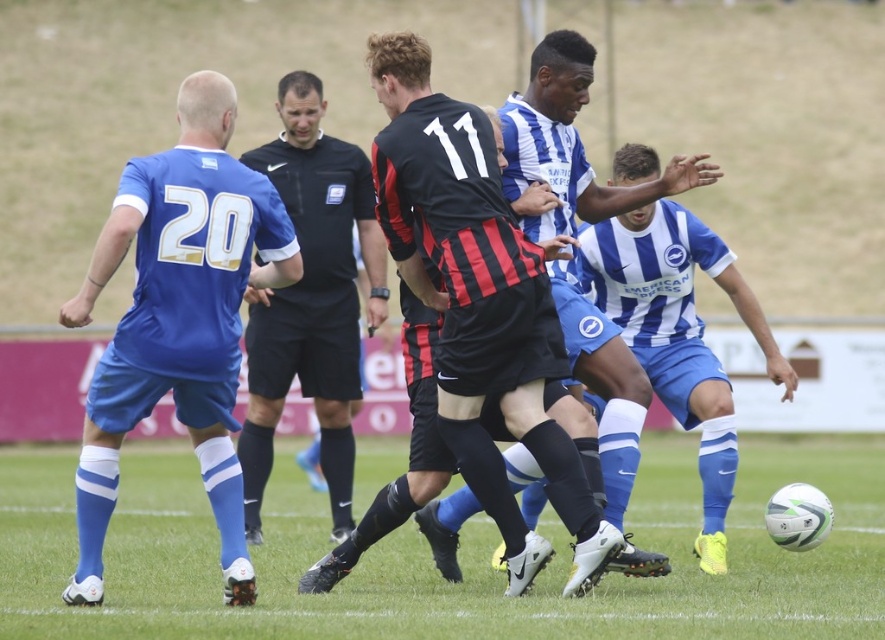
You are a soccer coach analyzing the game footage. You notice the white textured football at center and the blue striped jersey at center. Which object appears larger in the image?

The white textured football at center appears larger than the blue striped jersey at center in the image.

You are a soccer player positioned at the edge of the field. You need to pass the ball to your teammate wearing the matte blue jersey at left. The ball is currently with the player in the center holding the white textured football at center. Can you directly pass the ball to your teammate without the ball traveling more than 10 meters?

The white textured football at center and matte blue jersey at left are 10.18 meters apart. Since the distance exceeds 10 meters, the ball would need to travel more than 10 meters to reach the teammate, so the direct pass is not possible within the 10 meter limit.